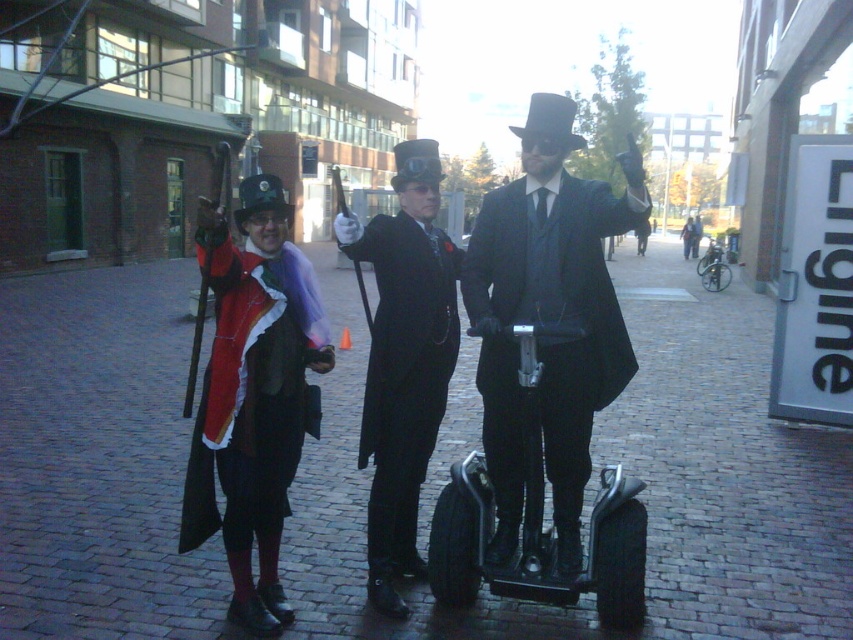
Does velvet red coat at left lie behind metallic silver scooter at center?

Yes.

Can you confirm if velvet red coat at left is thinner than metallic silver scooter at center?

Yes.

Describe the element at coordinates (253, 390) in the screenshot. I see `velvet red coat at left` at that location.

At what (x,y) coordinates should I click in order to perform the action: click on velvet red coat at left. Please return your answer as a coordinate pair (x, y). The image size is (853, 640). Looking at the image, I should click on (253, 390).

Does point (380, 310) lie behind point (546, 548)?

Yes, point (380, 310) is behind point (546, 548).

Does point (428, 422) lie in front of point (537, 381)?

No, (428, 422) is further to viewer.

Find the location of a particular element. The height and width of the screenshot is (640, 853). black glossy suit at center is located at coordinates (403, 360).

Is the position of matte black suit at center more distant than that of velvet red coat at left?

No, matte black suit at center is closer to the viewer.

Can you confirm if matte black suit at center is wider than velvet red coat at left?

Indeed, matte black suit at center has a greater width compared to velvet red coat at left.

From the picture: Who is more distant from viewer, [572,320] or [254,243]?

The point [254,243] is behind.

The image size is (853, 640). Find the location of `matte black suit at center`. matte black suit at center is located at coordinates (548, 316).